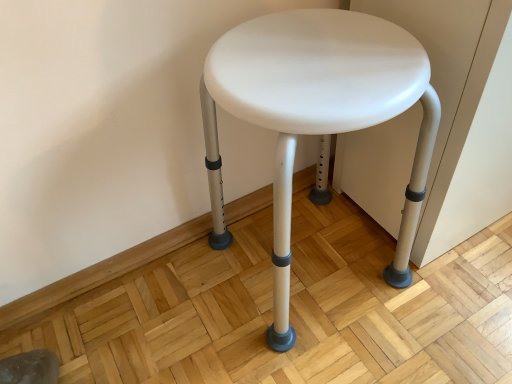
Image resolution: width=512 pixels, height=384 pixels. In order to click on vacant space underneath white plastic stool at center (from a real-world perspective) in this screenshot , I will do `click(307, 262)`.